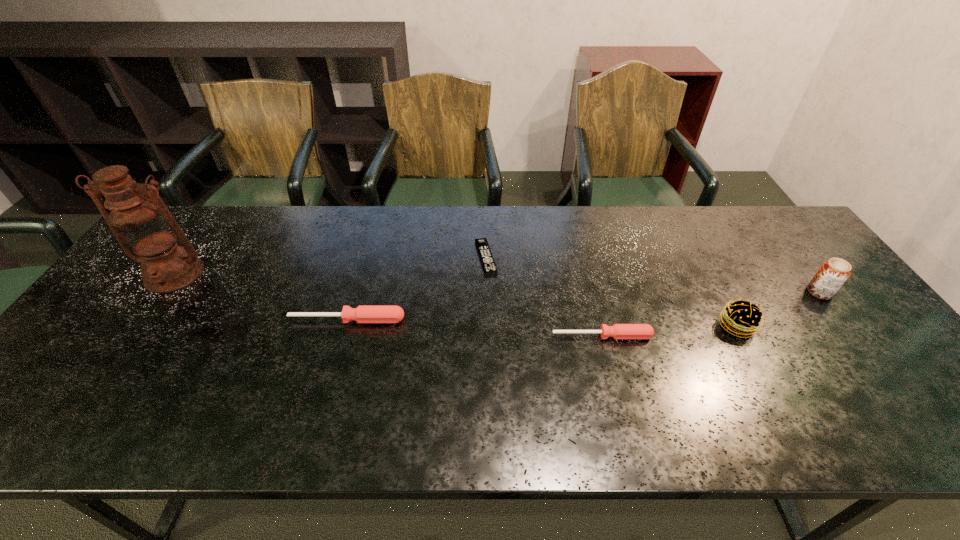
Image resolution: width=960 pixels, height=540 pixels. What are the coordinates of `free space between the fourth object from right to left and the right screwdriver` in the screenshot? It's located at (544, 296).

This screenshot has width=960, height=540. Find the location of `free space between the taller screwdriver and the patty`. free space between the taller screwdriver and the patty is located at coordinates tap(542, 323).

At what (x,y) coordinates should I click in order to perform the action: click on vacant space that's between the leftmost object and the third tallest object. Please return your answer as a coordinate pair (x, y). This screenshot has height=540, width=960. Looking at the image, I should click on (456, 300).

Identify the location of vacant point located between the third object from right to left and the left screwdriver. The image size is (960, 540). (474, 328).

Where is `free space between the nearer screwdriver and the third tallest object`? This screenshot has width=960, height=540. free space between the nearer screwdriver and the third tallest object is located at coordinates (669, 331).

Identify which object is located as the fourth nearest to the rightmost object. Please provide its 2D coordinates. Your answer should be formatted as a tuple, i.e. [(x, y)], where the tuple contains the x and y coordinates of a point satisfying the conditions above.

[(364, 313)]

Select which object appears as the third closest to the fifth object from right to left. Please provide its 2D coordinates. Your answer should be formatted as a tuple, i.e. [(x, y)], where the tuple contains the x and y coordinates of a point satisfying the conditions above.

[(618, 331)]

Locate an element on the screen. This screenshot has width=960, height=540. vacant space that satisfies the following two spatial constraints: 1. on the back side of the rightmost object; 2. on the right side of the patty is located at coordinates (719, 293).